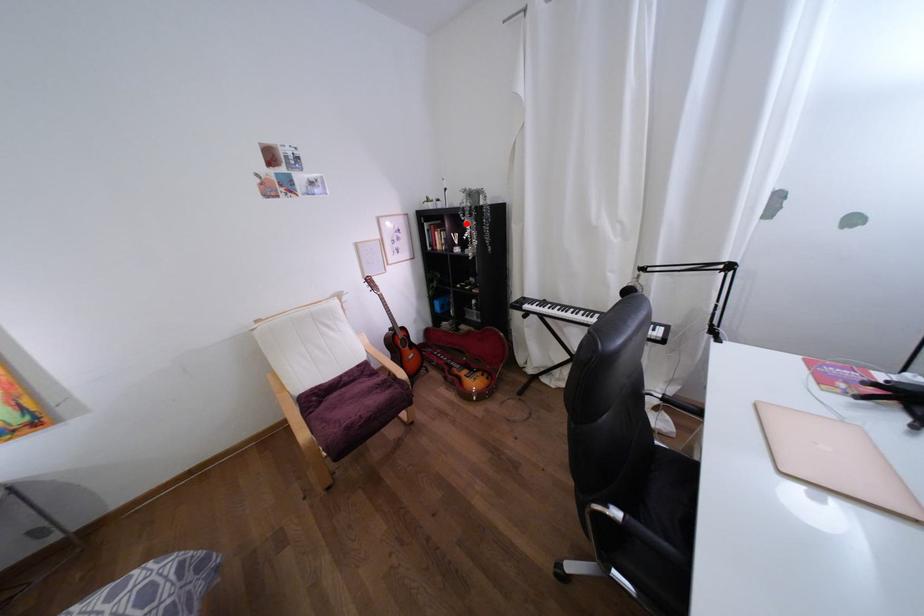
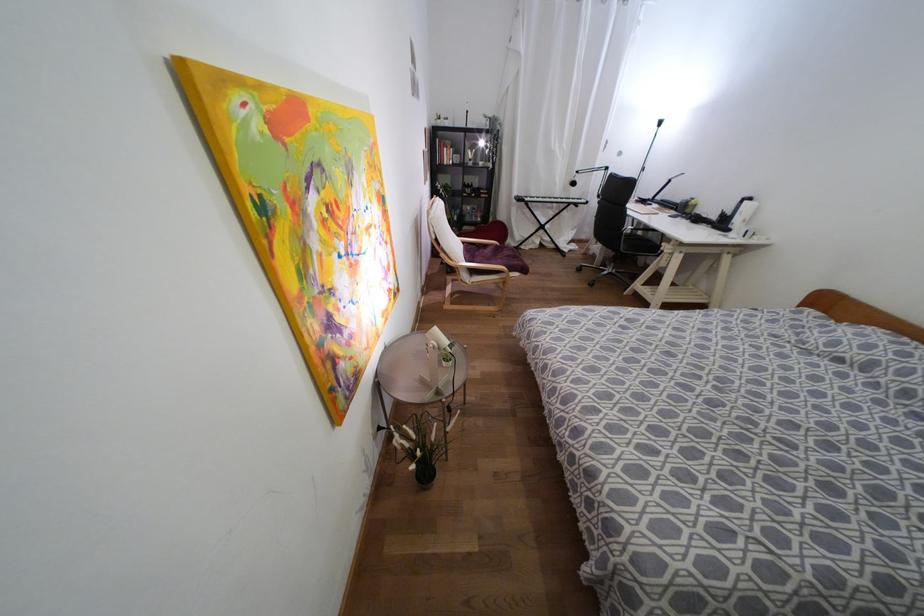
Question: A red point is marked in image1. In image2, is the corresponding 3D point closer to the camera or farther? Reply with the corresponding letter.

Choices:
 (A) The corresponding 3D point is closer.
 (B) The corresponding 3D point is farther.

Answer: (A)